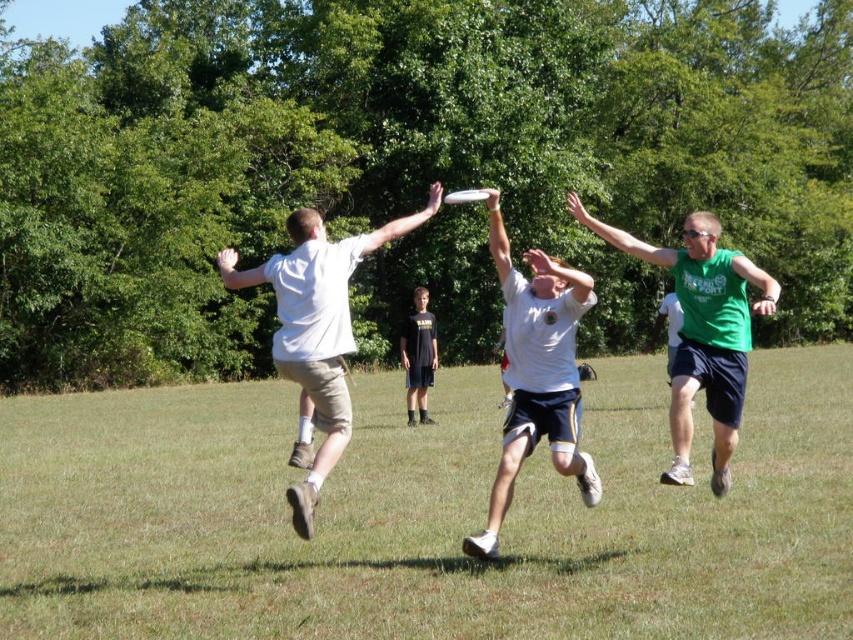
Question: Can you confirm if white matte shirt at center is wider than white plastic frisbee at center?

Choices:
 (A) yes
 (B) no

Answer: (A)

Question: Estimate the real-world distances between objects in this image. Which object is farther from the green sleeveless shirt at right?

Choices:
 (A) green grass at center
 (B) white matte shirt at center

Answer: (A)

Question: Considering the relative positions of green grass at center and white cotton shirt at center in the image provided, where is green grass at center located with respect to white cotton shirt at center?

Choices:
 (A) above
 (B) below

Answer: (B)

Question: Which point is closer to the camera taking this photo?

Choices:
 (A) (677, 436)
 (B) (454, 196)
 (C) (548, 432)

Answer: (B)

Question: Considering the real-world distances, which object is closest to the white matte shirt at center?

Choices:
 (A) green sleeveless shirt at right
 (B) white plastic frisbee at center
 (C) dark gray shorts at center

Answer: (A)

Question: Does white cotton shirt at center lie in front of dark gray shorts at center?

Choices:
 (A) yes
 (B) no

Answer: (A)